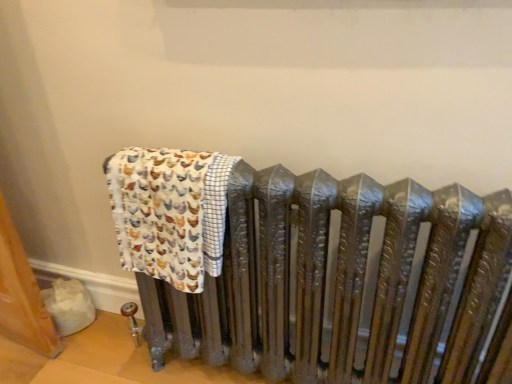
Find the location of a particular element. Image resolution: width=512 pixels, height=384 pixels. vacant region under patterned fabric towel at center (from a real-world perspective) is located at coordinates (201, 371).